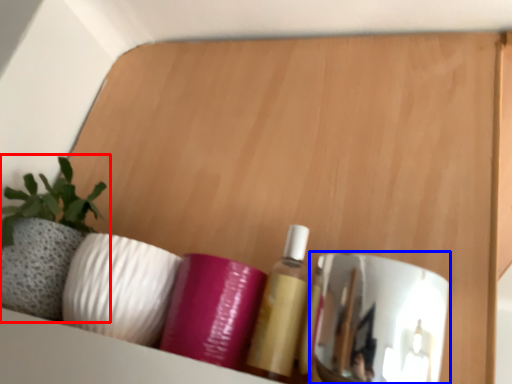
Question: Which point is further to the camera, houseplant (highlighted by a red box) or mirror (highlighted by a blue box)?

Choices:
 (A) houseplant
 (B) mirror

Answer: (A)